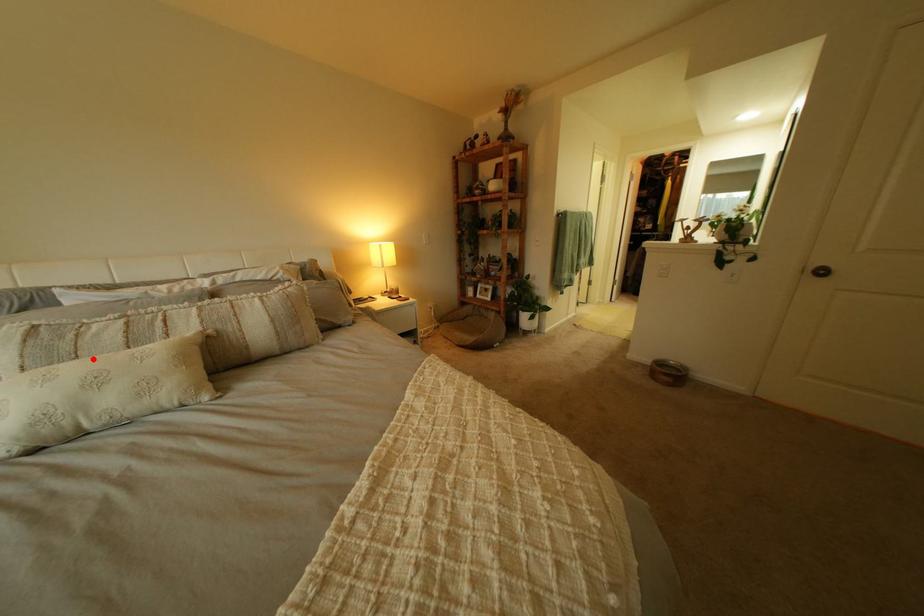
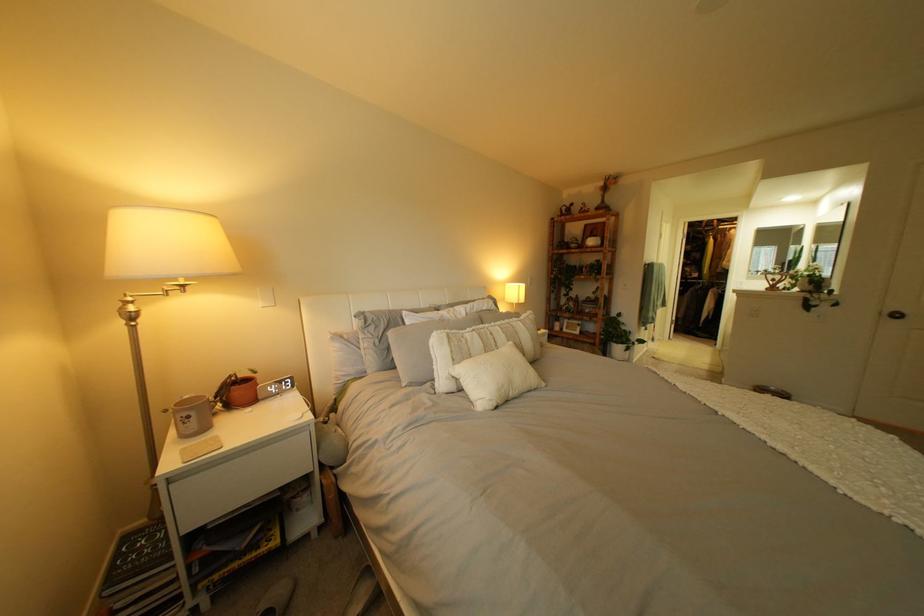
The point at the highlighted location is marked in the first image. Where is the corresponding point in the second image?

(485, 355)